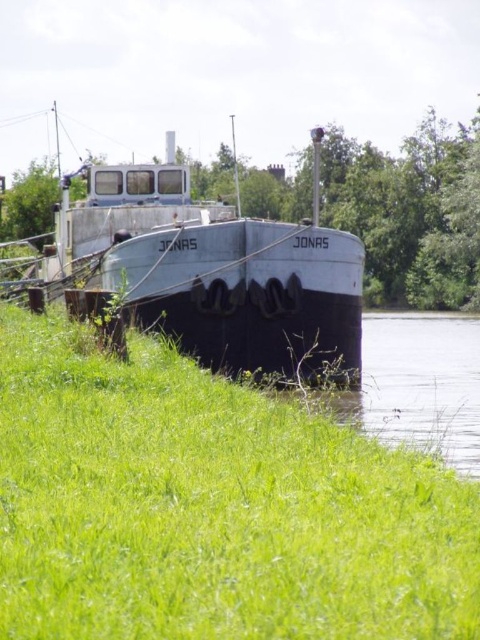
Which of these two, green grassy at lower left or rusty metal barge at center, stands taller?

With more height is rusty metal barge at center.

Between point (156, 525) and point (146, 204), which one is positioned behind?

Point (146, 204)

The height and width of the screenshot is (640, 480). Find the location of `green grassy at lower left`. green grassy at lower left is located at coordinates click(x=211, y=506).